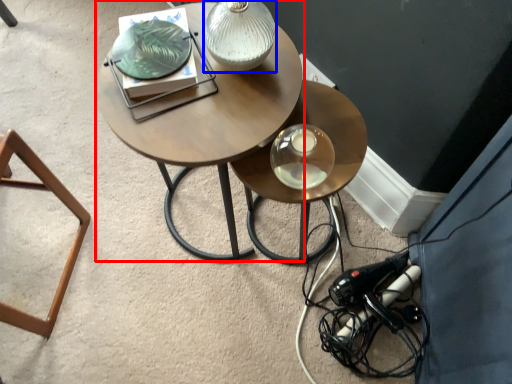
Question: Which point is closer to the camera, coffee table (highlighted by a red box) or table lamp (highlighted by a blue box)?

Choices:
 (A) coffee table
 (B) table lamp

Answer: (B)